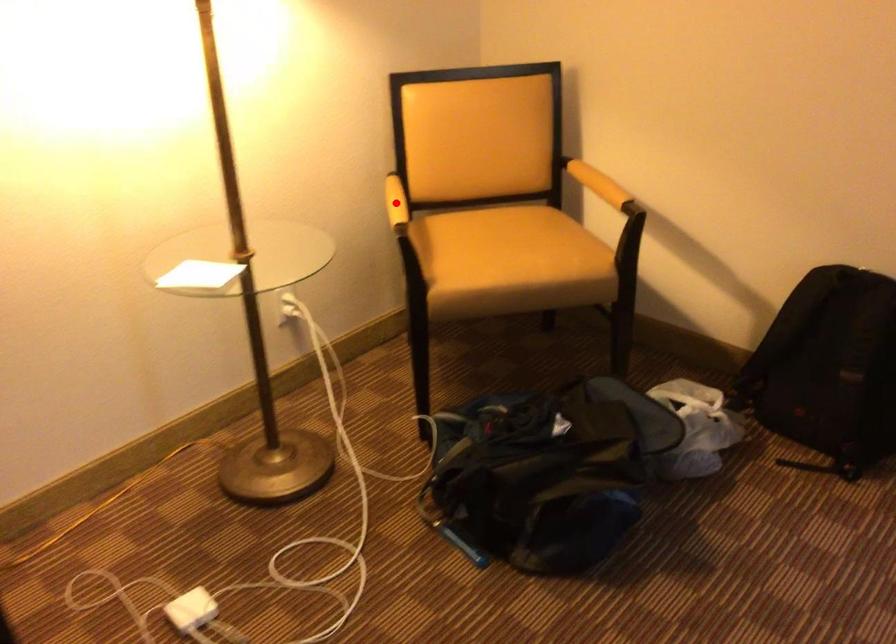
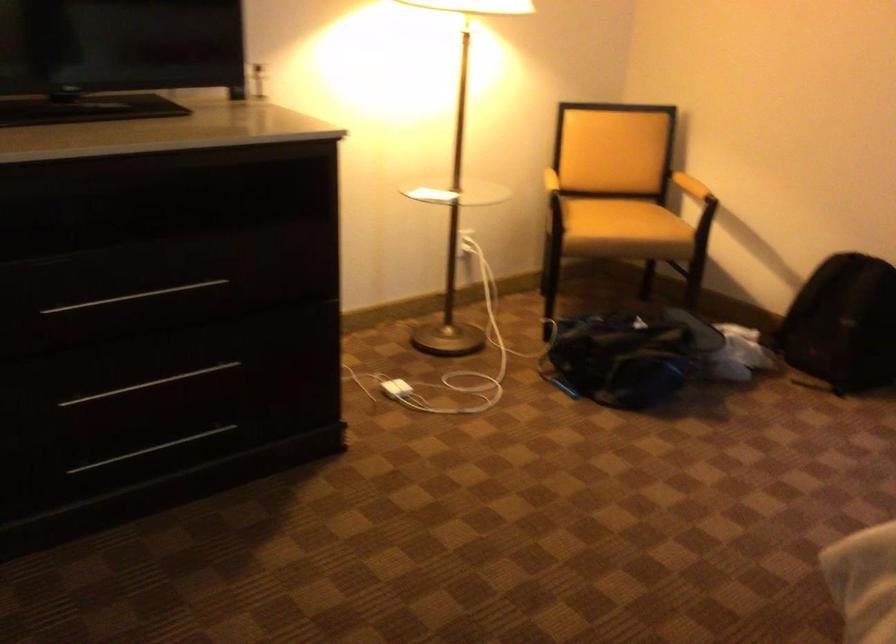
Locate, in the second image, the point that corresponds to the highlighted location in the first image.

(543, 174)